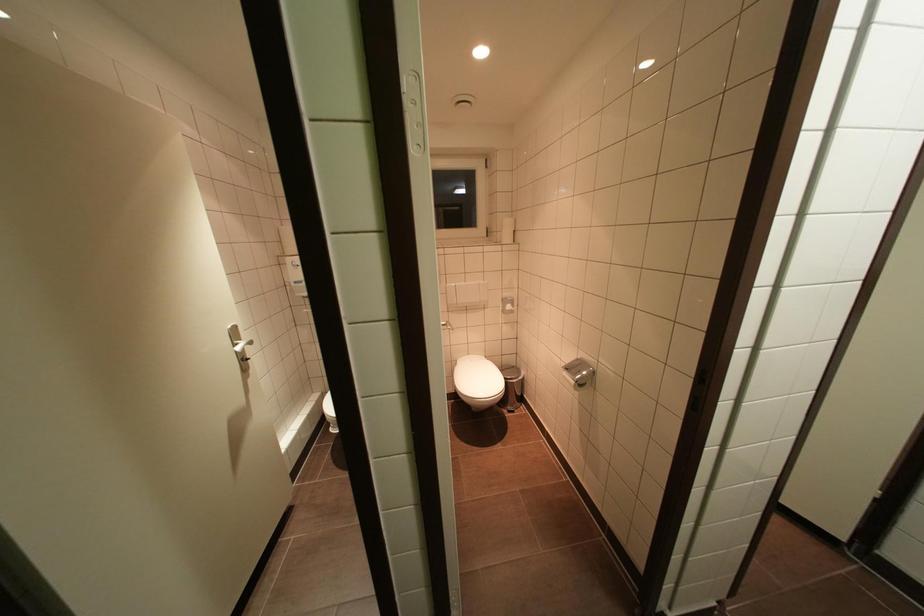
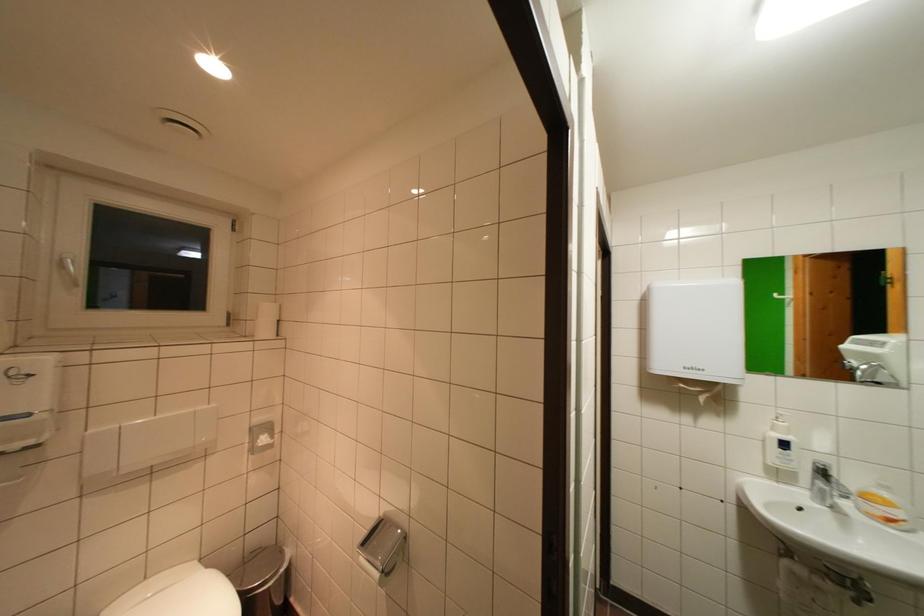
Locate, in the second image, the point that corresponds to point (572, 377) in the first image.

(370, 562)